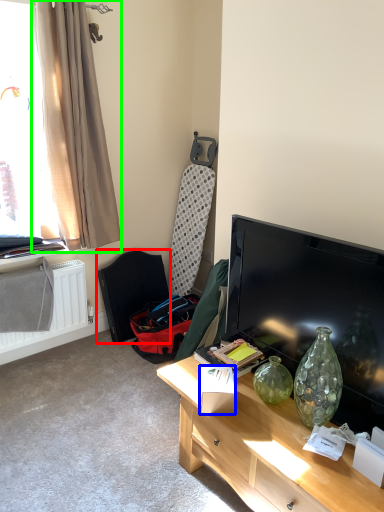
Question: Considering the real-world distances, which object is closest to armchair (highlighted by a red box)? box (highlighted by a blue box) or curtain (highlighted by a green box).

Choices:
 (A) box
 (B) curtain

Answer: (B)